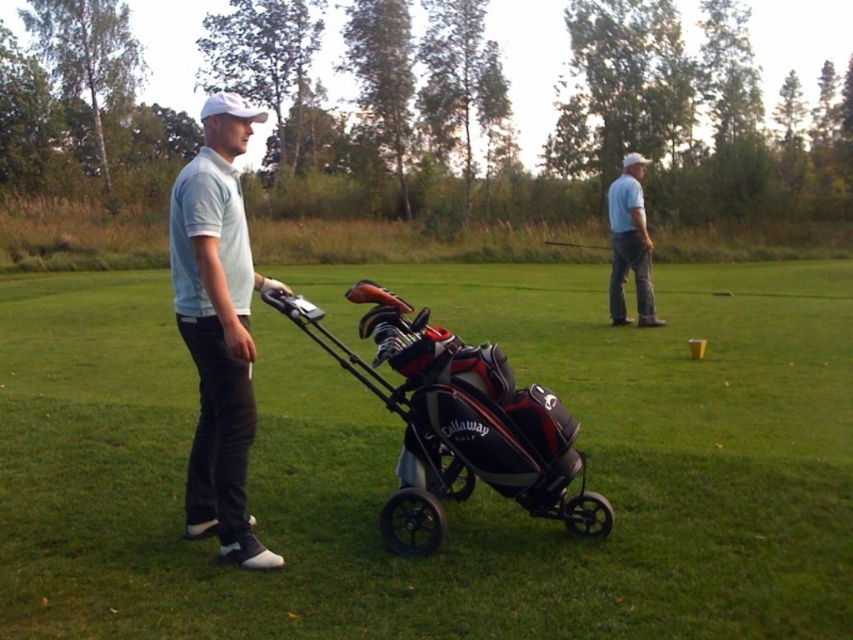
Question: Does black textured golf bag at center come behind light blue cotton polo shirt at center?

Choices:
 (A) no
 (B) yes

Answer: (B)

Question: Can you confirm if black fabric golf bag at center is wider than light blue cotton polo shirt at center?

Choices:
 (A) no
 (B) yes

Answer: (B)

Question: Among these objects, which one is farthest from the camera?

Choices:
 (A) metallic silver golf club at center
 (B) blue cotton shirt at upper right
 (C) black textured golf bag at center

Answer: (A)

Question: Which object appears farthest from the camera in this image?

Choices:
 (A) metallic silver golf club at center
 (B) black textured golf bag at center

Answer: (A)

Question: Can you confirm if black fabric golf bag at center is positioned below blue cotton shirt at upper right?

Choices:
 (A) no
 (B) yes

Answer: (B)

Question: Estimate the real-world distances between objects in this image. Which object is farther from the black fabric golf bag at center?

Choices:
 (A) light blue cotton polo shirt at center
 (B) metallic silver golf club at center
 (C) black textured golf bag at center

Answer: (B)